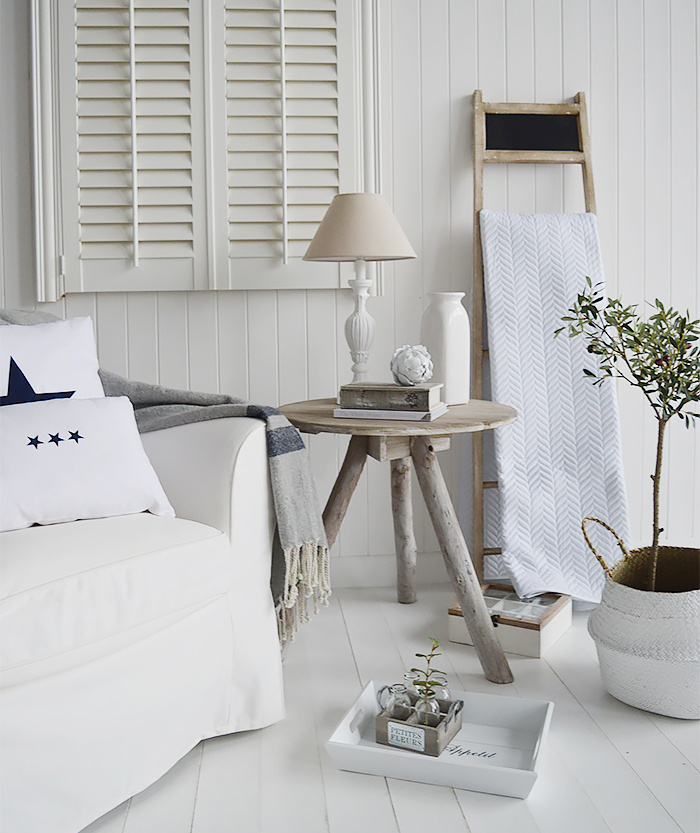
Where is `table`? table is located at coordinates (444, 427), (447, 546).